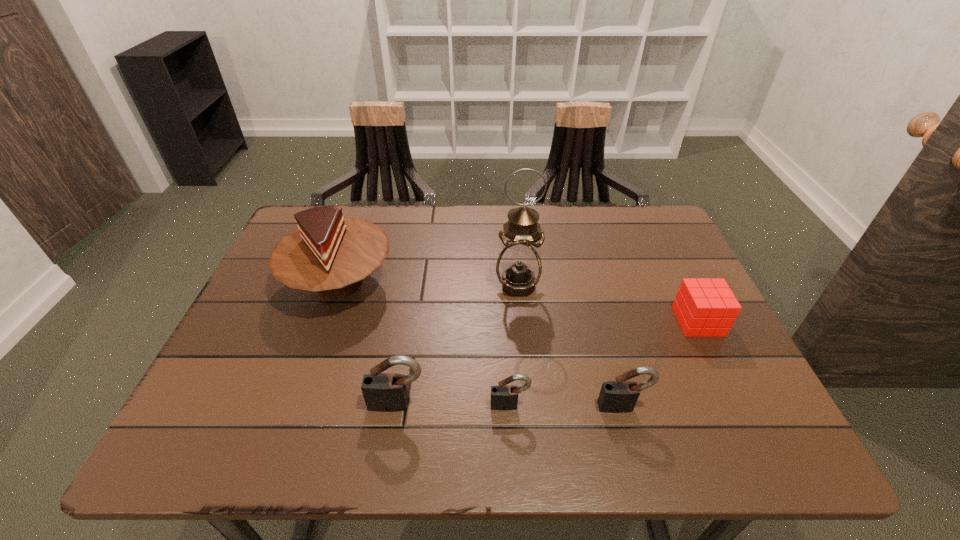
The image size is (960, 540). Identify the location of vacant region located 0.060m on the front of the rightmost object. (716, 358).

Where is `object that is at the far edge`? Image resolution: width=960 pixels, height=540 pixels. object that is at the far edge is located at coordinates (330, 254).

Where is `object that is at the left edge`? This screenshot has width=960, height=540. object that is at the left edge is located at coordinates (330, 254).

The width and height of the screenshot is (960, 540). What are the coordinates of `object at the right edge` in the screenshot? It's located at (704, 307).

At what (x,y) coordinates should I click in order to perform the action: click on object positioned at the far left corner. Please return your answer as a coordinate pair (x, y). Looking at the image, I should click on (330, 254).

The image size is (960, 540). Identify the location of free space at the far edge of the desktop. (476, 234).

Image resolution: width=960 pixels, height=540 pixels. I want to click on blank space at the near edge, so click(430, 403).

Identify the location of vacant space at the left edge of the desktop. (252, 365).

In the image, there is a desktop. What are the coordinates of `free space at the right edge` in the screenshot? It's located at (688, 263).

The height and width of the screenshot is (540, 960). What are the coordinates of `free region at the near left corner of the desktop` in the screenshot? It's located at (247, 390).